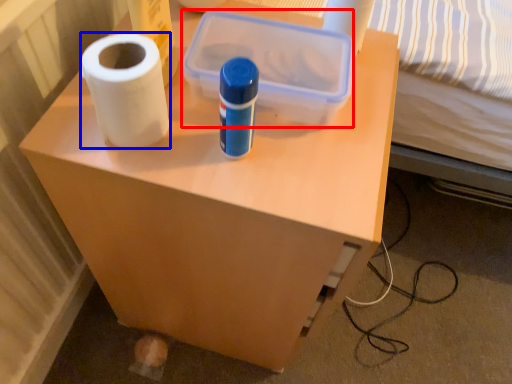
Question: Which object appears farthest to the camera in this image, storage box (highlighted by a red box) or paper towel (highlighted by a blue box)?

Choices:
 (A) storage box
 (B) paper towel

Answer: (A)